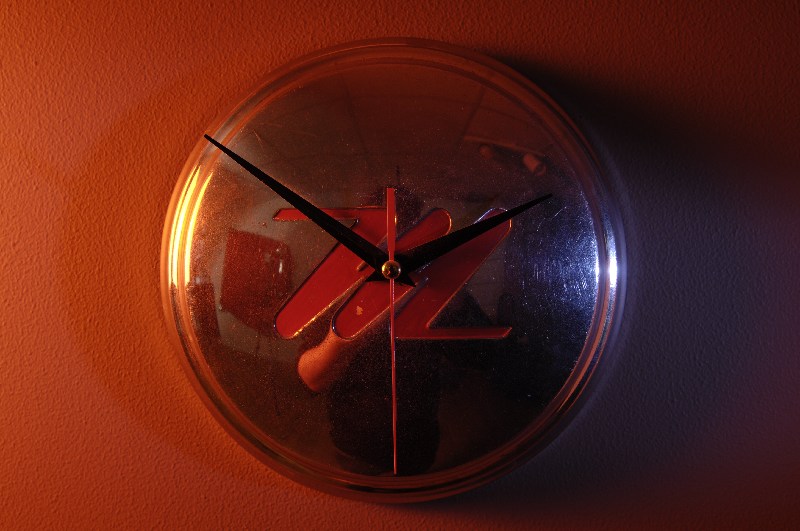
Identify the location of wall. (105, 238).